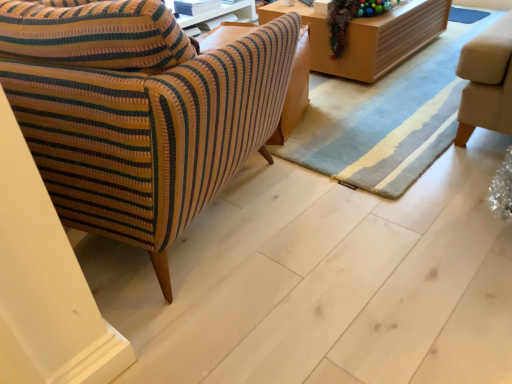
Where is `vacant area that lies to the right of striped fabric armchair at left`? The height and width of the screenshot is (384, 512). vacant area that lies to the right of striped fabric armchair at left is located at coordinates (369, 202).